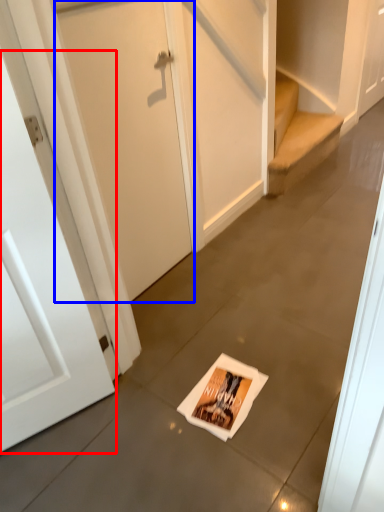
Question: Among these objects, which one is farthest to the camera, door (highlighted by a red box) or door (highlighted by a blue box)?

Choices:
 (A) door
 (B) door

Answer: (B)